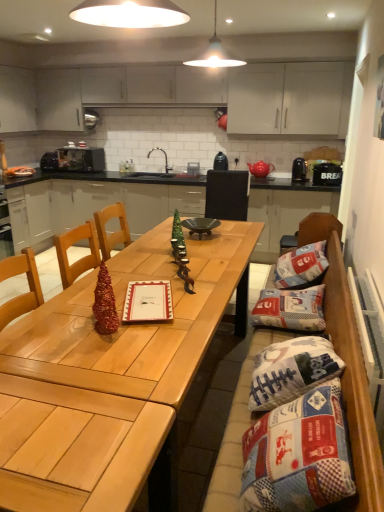
Question: From a real-world perspective, is black matte microwave at left, which is counted as the first appliance, starting from the left, above or below black plastic bread bin at right, arranged as the first appliance when viewed from the right?

Choices:
 (A) above
 (B) below

Answer: (B)

Question: In terms of size, does black matte microwave at left, arranged as the 5th appliance when viewed from the right, appear bigger or smaller than black plastic bread bin at right, arranged as the first appliance when viewed from the right?

Choices:
 (A) small
 (B) big

Answer: (B)

Question: Which of these objects is positioned farthest from the patchwork fabric bean bag chair at center?

Choices:
 (A) black matte sink at center
 (B) shiny metallic christmas tree at center, which is counted as the first christmas tree, starting from the front
 (C) green matte christmas tree at center, which is counted as the 2th christmas tree, starting from the bottom
 (D) black matte microwave at left, which is counted as the first appliance, starting from the left
 (E) metallic microwave at upper left, the second appliance when ordered from left to right

Answer: (D)

Question: Estimate the real-world distances between objects in this image. Which object is closer to the black plastic toaster at upper center, the 4th appliance viewed from the left?

Choices:
 (A) shiny metallic christmas tree at center, which is counted as the first christmas tree, starting from the front
 (B) wooden chair at center
 (C) patchwork fabric pillow at right, which is counted as the first pillow, starting from the back
 (D) black matte sink at center
 (E) shiny wood table at center

Answer: (B)